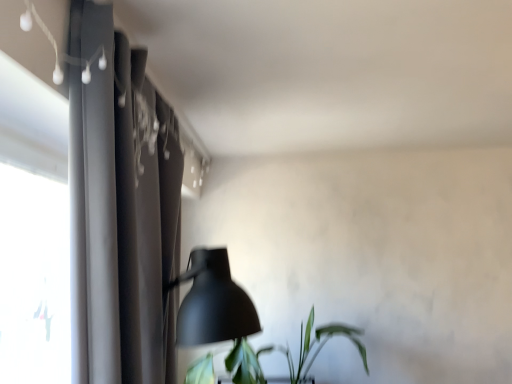
Question: Is green leafy plant at lower right taller or shorter than dark gray fabric curtain at left?

Choices:
 (A) tall
 (B) short

Answer: (B)

Question: Considering their positions, is green leafy plant at lower right located in front of or behind dark gray fabric curtain at left?

Choices:
 (A) behind
 (B) front

Answer: (A)

Question: Looking at their shapes, would you say green leafy plant at lower right is wider or thinner than dark gray fabric curtain at left?

Choices:
 (A) wide
 (B) thin

Answer: (A)

Question: Looking at the image, does dark gray fabric curtain at left seem bigger or smaller compared to green leafy plant at lower right?

Choices:
 (A) big
 (B) small

Answer: (B)

Question: Looking at their shapes, would you say dark gray fabric curtain at left is wider or thinner than green leafy plant at lower right?

Choices:
 (A) wide
 (B) thin

Answer: (B)

Question: From the image's perspective, is dark gray fabric curtain at left positioned above or below green leafy plant at lower right?

Choices:
 (A) above
 (B) below

Answer: (A)

Question: In the image, is dark gray fabric curtain at left on the left side or the right side of green leafy plant at lower right?

Choices:
 (A) left
 (B) right

Answer: (A)